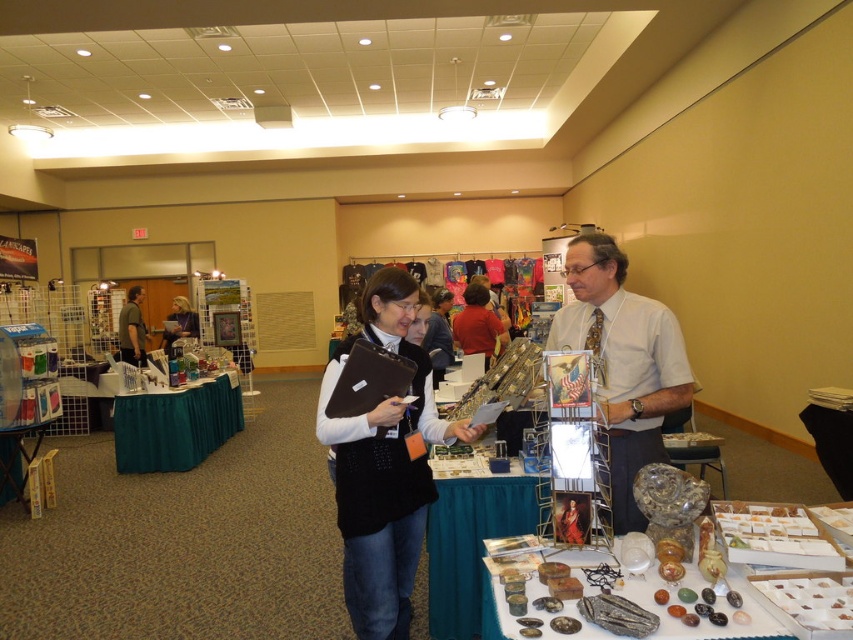
You are a photographer at a trade show who needs to take a photo of the light gray shirt at center. Your camera is 6.08 feet away from the shirt. Do you think you can take a clear photo from this distance?

Yes, the light gray shirt at center and camera are 6.08 feet apart, which is a suitable distance for taking a clear photo.

In the scene shown: You are standing at the entrance of the convention hall and see the point at coordinates (624, 362). Based on the scene description, what object or part of the scene is located at that point?

The point at coordinates (624, 362) is located on the light gray shirt at center.